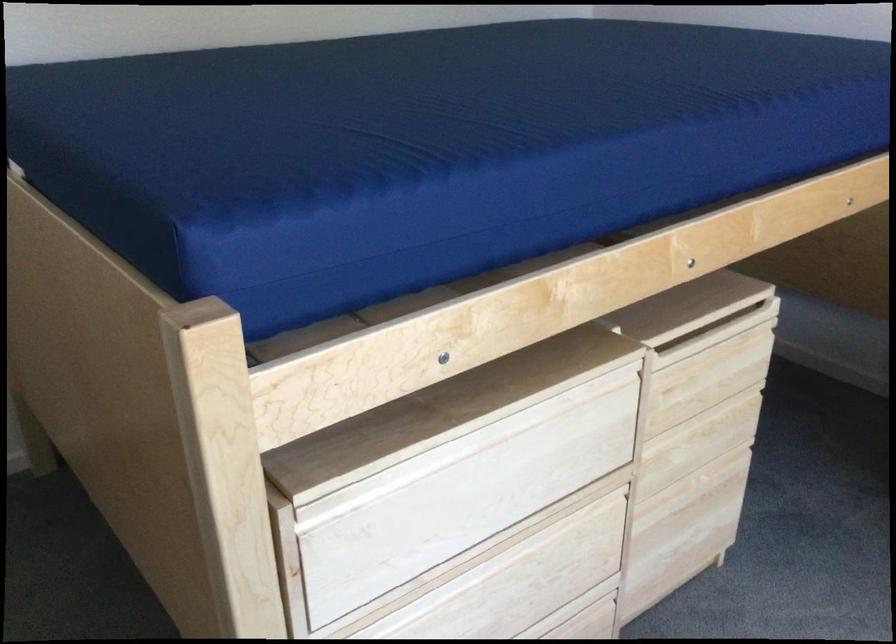
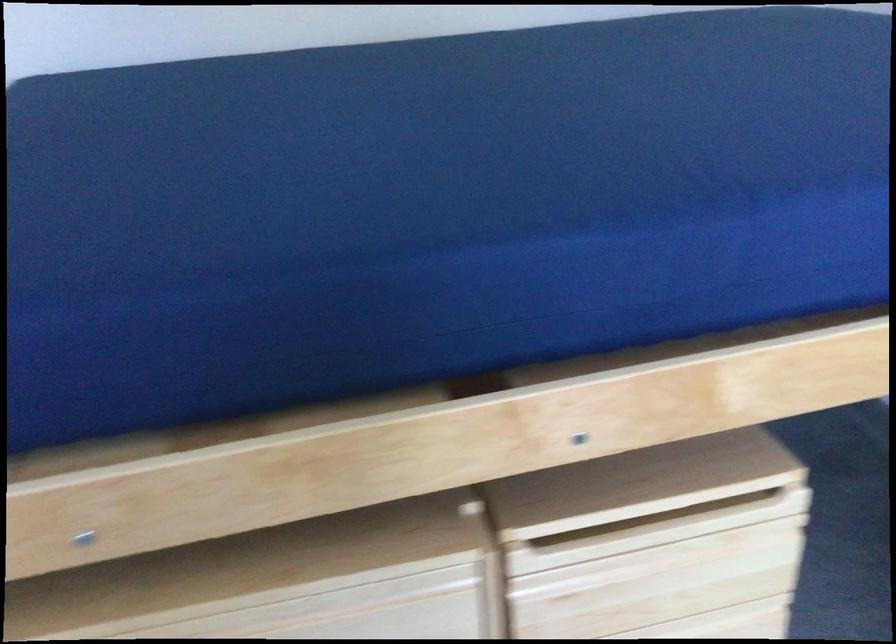
The point at [731,410] is marked in the first image. Where is the corresponding point in the second image?

(725, 623)